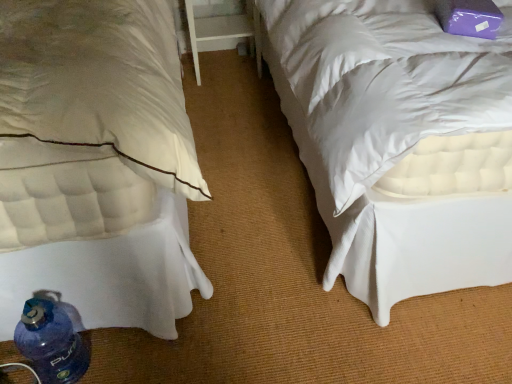
You are a GUI agent. You are given a task and a screenshot of the screen. Output one action in this format:
    pyautogui.click(x=<x>, y=<y>)
    Task: Click on the vacant space to the right of blue plastic bottle at lower left
    
    Given the screenshot: What is the action you would take?
    pyautogui.click(x=120, y=354)